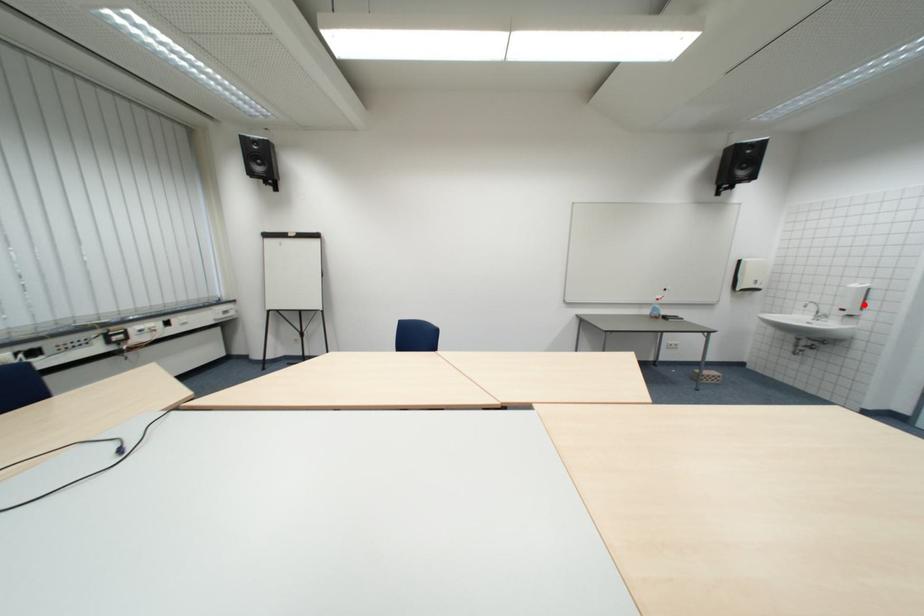
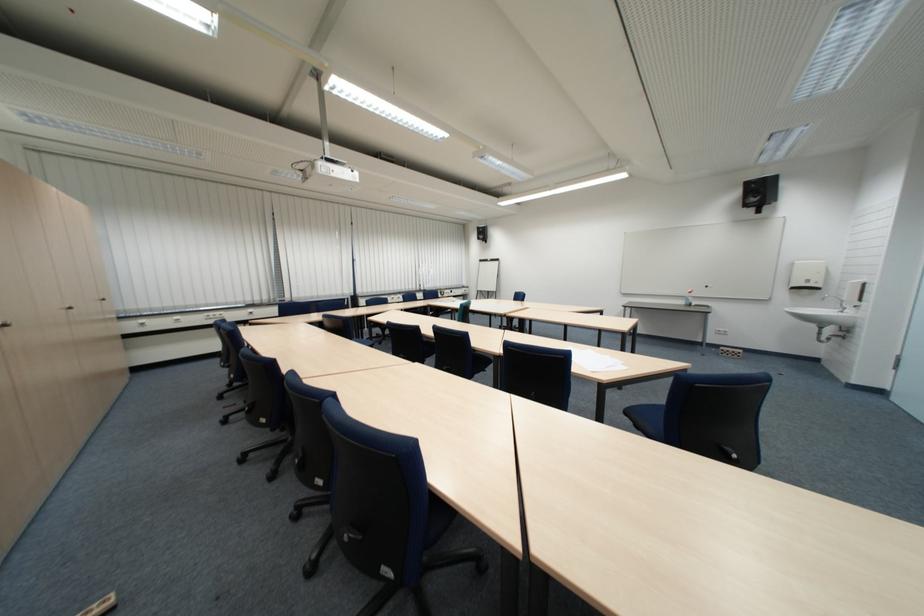
The point at the highlighted location is marked in the first image. Where is the corresponding point in the second image?

(860, 296)